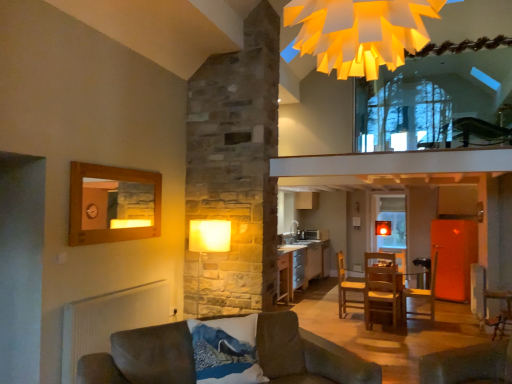
Describe the element at coordinates (360, 32) in the screenshot. The width and height of the screenshot is (512, 384). I see `yellow paper chandelier at upper center` at that location.

In order to face yellow paper chandelier at upper center, should I rotate leftwards or rightwards?

Turn right approximately 19.544 degrees to face it.

What do you see at coordinates (429, 99) in the screenshot? I see `transparent glass window at upper center` at bounding box center [429, 99].

Measure the distance between velvet brown armchair at lower right, which appears as the 1th armchair when viewed from the right, and camera.

A distance of 3.93 meters exists between velvet brown armchair at lower right, which appears as the 1th armchair when viewed from the right, and camera.

Where is `silver metallic cabinet at center`? The width and height of the screenshot is (512, 384). silver metallic cabinet at center is located at coordinates (306, 262).

Locate an element on the screen. The width and height of the screenshot is (512, 384). velvet brown couch at lower left is located at coordinates (307, 355).

Between transparent glass window at upper center and velvet brown couch at lower left, which one is positioned behind?

transparent glass window at upper center is further away from the camera.

From the image's perspective, is transparent glass window at upper center above velvet brown couch at lower left?

Indeed, from the image's perspective, transparent glass window at upper center is shown above velvet brown couch at lower left.

I want to click on window above the velvet brown couch at lower left (from a real-world perspective), so click(x=429, y=99).

At what (x,y) coordinates should I click in order to perform the action: click on pillow on the left of the wooden chair at center, which is counted as the 2th armchair, starting from the right. Please return your answer as a coordinate pair (x, y). The image size is (512, 384). Looking at the image, I should click on click(226, 350).

Considering the relative positions of blue textured pillow at lower center and wooden chair at center, the first armchair viewed from the back, in the image provided, is blue textured pillow at lower center to the left of wooden chair at center, the first armchair viewed from the back, from the viewer's perspective?

Indeed, blue textured pillow at lower center is positioned on the left side of wooden chair at center, the first armchair viewed from the back.

Does point (241, 377) come closer to viewer compared to point (343, 262)?

Yes, point (241, 377) is closer to viewer.

From the image's perspective, which object appears higher, blue textured pillow at lower center or wooden chair at center, which ranks as the 1th armchair in left-to-right order?

blue textured pillow at lower center, from the image's perspective.

How different are the orientations of transparent glass window at upper center and blue textured pillow at lower center in degrees?

130 degrees.

From the image's perspective, would you say transparent glass window at upper center is positioned over blue textured pillow at lower center?

Yes.

Can we say transparent glass window at upper center lies outside blue textured pillow at lower center?

Yes, transparent glass window at upper center is not within blue textured pillow at lower center.

Is transparent glass window at upper center turned away from blue textured pillow at lower center?

transparent glass window at upper center does not have its back to blue textured pillow at lower center.

From a real-world perspective, who is located higher, wooden chair at center, which is the 2th armchair from front to back, or yellow paper chandelier at upper center?

From a 3D spatial view, yellow paper chandelier at upper center is above.

Does point (356, 286) come closer to viewer compared to point (334, 7)?

No.

From their relative heights in the image, would you say wooden chair at center, which is the 2th armchair from front to back, is taller or shorter than yellow paper chandelier at upper center?

Considering their sizes, wooden chair at center, which is the 2th armchair from front to back, has more height than yellow paper chandelier at upper center.

What's the angular difference between wooden chair at center, which is the 2th armchair from front to back, and yellow paper chandelier at upper center's facing directions?

89 degrees.

Is blue textured pillow at lower center inside the boundaries of velvet brown armchair at lower right, which is the second armchair in left-to-right order, or outside?

blue textured pillow at lower center exists outside the volume of velvet brown armchair at lower right, which is the second armchair in left-to-right order.

From the image's perspective, is blue textured pillow at lower center positioned above or below velvet brown armchair at lower right, which appears as the 1th armchair when viewed from the right?

Clearly, from the image's perspective, blue textured pillow at lower center is above velvet brown armchair at lower right, which appears as the 1th armchair when viewed from the right.

Is point (228, 318) less distant than point (500, 290)?

Yes, it is in front of point (500, 290).

Which is closer to the camera, (292, 285) or (502, 327)?

Point (292, 285).

Would you say silver metallic cabinet at center is to the left or to the right of velvet brown armchair at lower right, which is the second armchair in left-to-right order, in the picture?

silver metallic cabinet at center is to the left of velvet brown armchair at lower right, which is the second armchair in left-to-right order.

Considering their positions, is silver metallic cabinet at center located in front of or behind velvet brown armchair at lower right, which is the second armchair in left-to-right order?

Visually, silver metallic cabinet at center is located behind velvet brown armchair at lower right, which is the second armchair in left-to-right order.

Considering their positions, is yellow paper chandelier at upper center located in front of or behind velvet brown couch at lower left?

yellow paper chandelier at upper center is positioned farther from the viewer than velvet brown couch at lower left.

Who is smaller, yellow paper chandelier at upper center or velvet brown couch at lower left?

yellow paper chandelier at upper center is smaller.

Which of these two, yellow paper chandelier at upper center or velvet brown couch at lower left, stands shorter?

With less height is yellow paper chandelier at upper center.

Locate an element on the screen. The image size is (512, 384). window on the right of velvet brown couch at lower left is located at coordinates (429, 99).

From the image's perspective, which armchair is the 2nd one below the blue textured pillow at lower center? Please provide its 2D coordinates.

[(347, 288)]

Looking at the image, which one is located closer to transparent glass window at upper center, yellow paper chandelier at upper center or velvet brown armchair at lower right, arranged as the second armchair when viewed from the back?

velvet brown armchair at lower right, arranged as the second armchair when viewed from the back, is closer to transparent glass window at upper center.

From the image, which object appears to be farther from wooden chair at center, which is the 2th armchair from front to back, wooden table at center or velvet brown couch at lower left?

velvet brown couch at lower left lies further to wooden chair at center, which is the 2th armchair from front to back, than the other object.

Looking at the image, which one is located further to wooden table at center, velvet brown couch at lower left or yellow paper chandelier at upper center?

yellow paper chandelier at upper center lies further to wooden table at center than the other object.

Consider the image. Estimate the real-world distances between objects in this image. Which object is further from transparent glass window at upper center, yellow paper chandelier at upper center or wooden chair at center, which is counted as the 2th armchair, starting from the right?

The object further to transparent glass window at upper center is yellow paper chandelier at upper center.

Which object lies nearer to the anchor point transparent glass window at upper center, wooden chair at center, which is the 2th armchair from front to back, or velvet brown couch at lower left?

wooden chair at center, which is the 2th armchair from front to back.

From the image, which object appears to be nearer to silver metallic cabinet at center, wooden table at center or blue textured pillow at lower center?

wooden table at center is closer to silver metallic cabinet at center.

Looking at the image, which one is located further to blue textured pillow at lower center, velvet brown armchair at lower right, which appears as the 1th armchair when viewed from the right, or velvet brown couch at lower left?

The object further to blue textured pillow at lower center is velvet brown armchair at lower right, which appears as the 1th armchair when viewed from the right.

Based on their spatial positions, is yellow paper chandelier at upper center or velvet brown armchair at lower right, which is the second armchair in left-to-right order, further from wooden table at center?

yellow paper chandelier at upper center is further to wooden table at center.

Locate an element on the screen. The width and height of the screenshot is (512, 384). cabinetry that lies between yellow paper chandelier at upper center and wooden table at center from top to bottom is located at coordinates (306, 262).

Locate an element on the screen. window located between velvet brown armchair at lower right, which appears as the 1th armchair when viewed from the right, and silver metallic cabinet at center in the depth direction is located at coordinates (429, 99).

Locate an element on the screen. armchair located between blue textured pillow at lower center and wooden table at center in the depth direction is located at coordinates (494, 297).

This screenshot has height=384, width=512. I want to click on window that lies between yellow paper chandelier at upper center and blue textured pillow at lower center from top to bottom, so click(x=429, y=99).